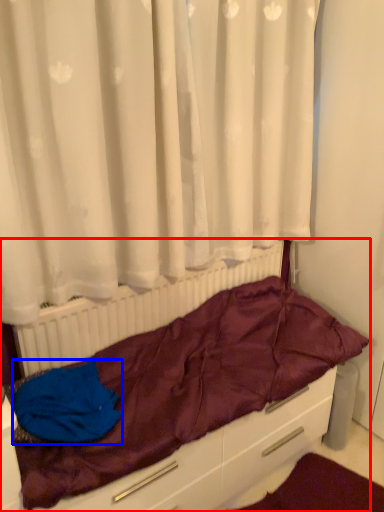
Question: Which of the following is the farthest to the observer, furniture (highlighted by a red box) or material (highlighted by a blue box)?

Choices:
 (A) furniture
 (B) material

Answer: (B)